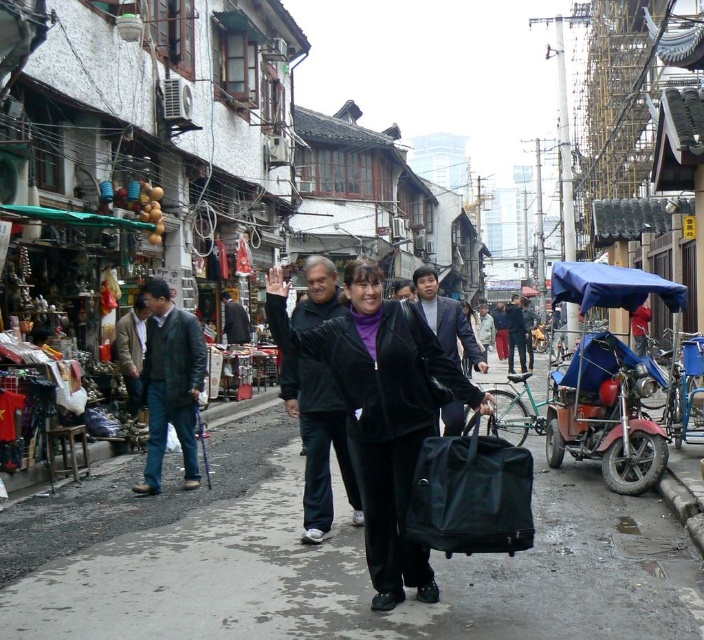
Consider the image. Is black leather bag at center closer to camera compared to dark blue jacket at center?

Yes, black leather bag at center is in front of dark blue jacket at center.

Between point (458, 532) and point (509, 339), which one is positioned in front?

Point (458, 532)

The height and width of the screenshot is (640, 704). I want to click on black leather bag at center, so click(471, 493).

Who is positioned more to the left, dark blue jeans at left or dark brown leather jacket at left?

From the viewer's perspective, dark brown leather jacket at left appears more on the left side.

Can you confirm if dark blue jeans at left is wider than dark brown leather jacket at left?

Yes, dark blue jeans at left is wider than dark brown leather jacket at left.

This screenshot has height=640, width=704. In order to click on dark blue jeans at left in this screenshot , I will do `click(170, 384)`.

Between black velvety jacket at center and dark blue jeans at left, which one is positioned lower?

Positioned lower is dark blue jeans at left.

This screenshot has height=640, width=704. I want to click on black velvety jacket at center, so click(379, 412).

The width and height of the screenshot is (704, 640). I want to click on black velvety jacket at center, so click(x=379, y=412).